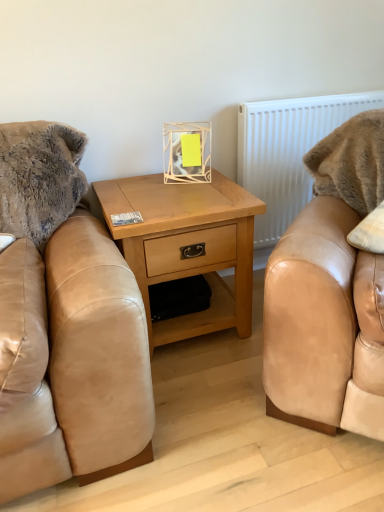
Question: Considering the positions of white plastic radiator at upper right and light wood/texture nightstand at center in the image, is white plastic radiator at upper right wider or thinner than light wood/texture nightstand at center?

Choices:
 (A) thin
 (B) wide

Answer: (A)

Question: Does point (349, 108) appear closer or farther from the camera than point (244, 314)?

Choices:
 (A) closer
 (B) farther

Answer: (B)

Question: Which is correct: white plastic radiator at upper right is inside light wood/texture nightstand at center, or outside of it?

Choices:
 (A) inside
 (B) outside

Answer: (B)

Question: Is point (195, 211) closer or farther from the camera than point (256, 225)?

Choices:
 (A) closer
 (B) farther

Answer: (A)

Question: Is light wood/texture nightstand at center in front of or behind white plastic radiator at upper right in the image?

Choices:
 (A) behind
 (B) front

Answer: (B)

Question: From a real-world perspective, is light wood/texture nightstand at center positioned above or below white plastic radiator at upper right?

Choices:
 (A) below
 (B) above

Answer: (A)

Question: Is light wood/texture nightstand at center spatially inside white plastic radiator at upper right, or outside of it?

Choices:
 (A) inside
 (B) outside

Answer: (B)